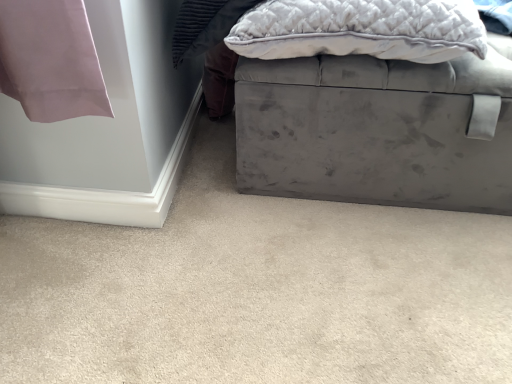
Where is `free spot in front of velvet gray ottoman at center`? This screenshot has height=384, width=512. free spot in front of velvet gray ottoman at center is located at coordinates (360, 283).